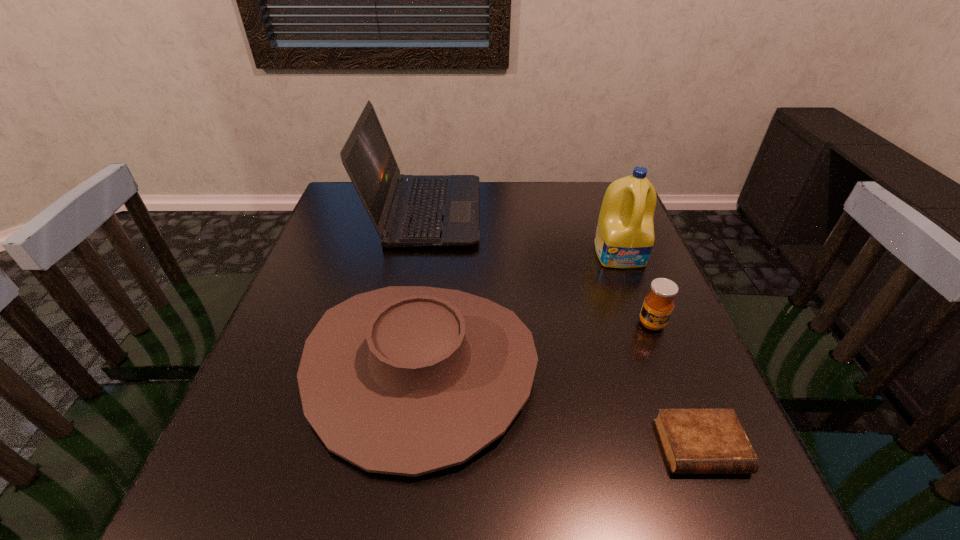
Find the location of a particular element. The width and height of the screenshot is (960, 540). vacant area between the honey and the detergent is located at coordinates (636, 289).

The image size is (960, 540). I want to click on vacant area that lies between the honey and the cowboy hat, so click(x=537, y=346).

Where is `free space that is in between the laptop_computer and the detergent`? The width and height of the screenshot is (960, 540). free space that is in between the laptop_computer and the detergent is located at coordinates (523, 233).

The width and height of the screenshot is (960, 540). What are the coordinates of `free space between the detergent and the laptop_computer` in the screenshot? It's located at (523, 233).

Locate an element on the screen. This screenshot has width=960, height=540. the third closest object relative to the honey is located at coordinates (404, 380).

Identify which object is the second closest to the laptop_computer. Please provide its 2D coordinates. Your answer should be formatted as a tuple, i.e. [(x, y)], where the tuple contains the x and y coordinates of a point satisfying the conditions above.

[(624, 238)]

Image resolution: width=960 pixels, height=540 pixels. In order to click on free spot that satisfies the following two spatial constraints: 1. on the screen of the cowboy hat; 2. on the left side of the laptop_computer in this screenshot , I will do `click(399, 367)`.